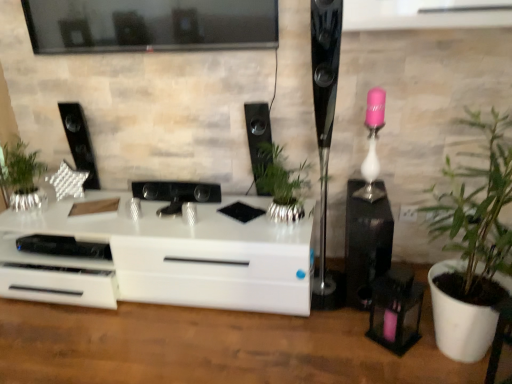
At what (x,y) coordinates should I click in order to perform the action: click on vacant area that is in front of black textured speaker at left, the 1th speaker viewed from the left. Please return your answer as a coordinate pair (x, y). The width and height of the screenshot is (512, 384). Looking at the image, I should click on (73, 202).